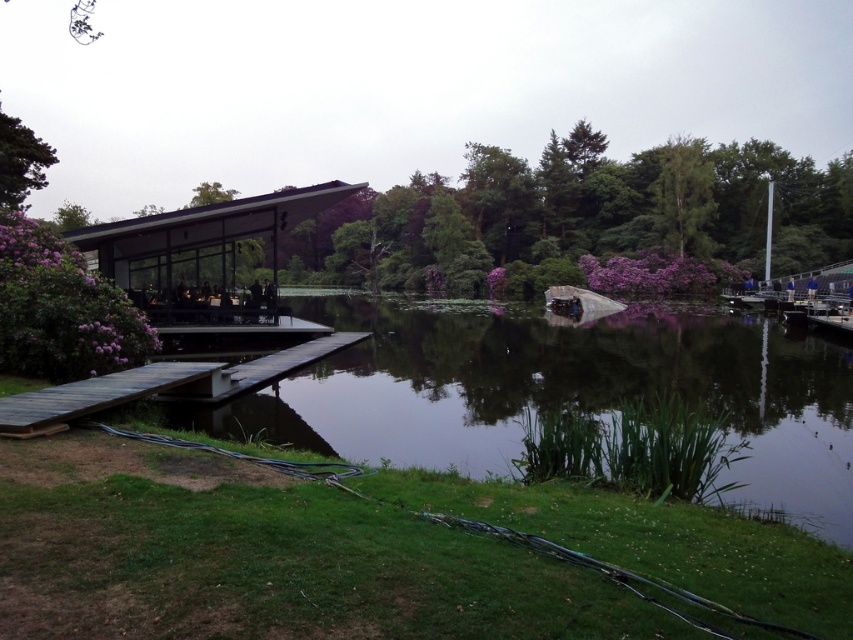
Question: Which point appears closest to the camera in this image?

Choices:
 (A) (44, 141)
 (B) (701, 355)
 (C) (107, 387)

Answer: (C)

Question: Which of the following is the closest to the observer?

Choices:
 (A) brown wooden dock at lower left
 (B) green leafy tree at upper right

Answer: (A)

Question: Does transparent glass water at center appear on the right side of purple leafy tree at upper center?

Choices:
 (A) no
 (B) yes

Answer: (A)

Question: Is transparent glass water at center smaller than green leafy tree at upper left?

Choices:
 (A) no
 (B) yes

Answer: (A)

Question: Is transparent glass gazebo at center wider than green leafy tree at upper left?

Choices:
 (A) yes
 (B) no

Answer: (A)

Question: Which point is farther to the camera?

Choices:
 (A) green leafy tree at upper right
 (B) transparent glass water at center
 (C) green leafy tree at upper left

Answer: (A)